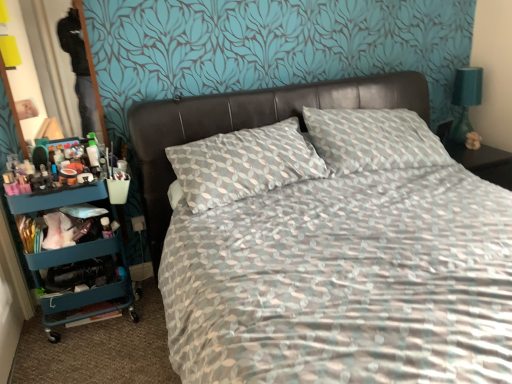
Locate an element on the screen. The height and width of the screenshot is (384, 512). free location above teal plastic cart at left (from a real-world perspective) is located at coordinates (54, 180).